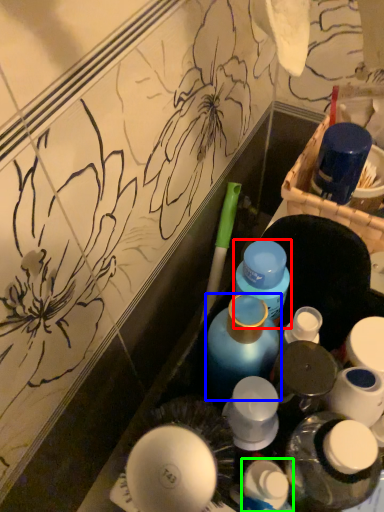
Question: Estimate the real-world distances between objects in this image. Which object is farther from bottle (highlighted by a red box), bottle (highlighted by a blue box) or toiletry (highlighted by a green box)?

Choices:
 (A) bottle
 (B) toiletry

Answer: (B)